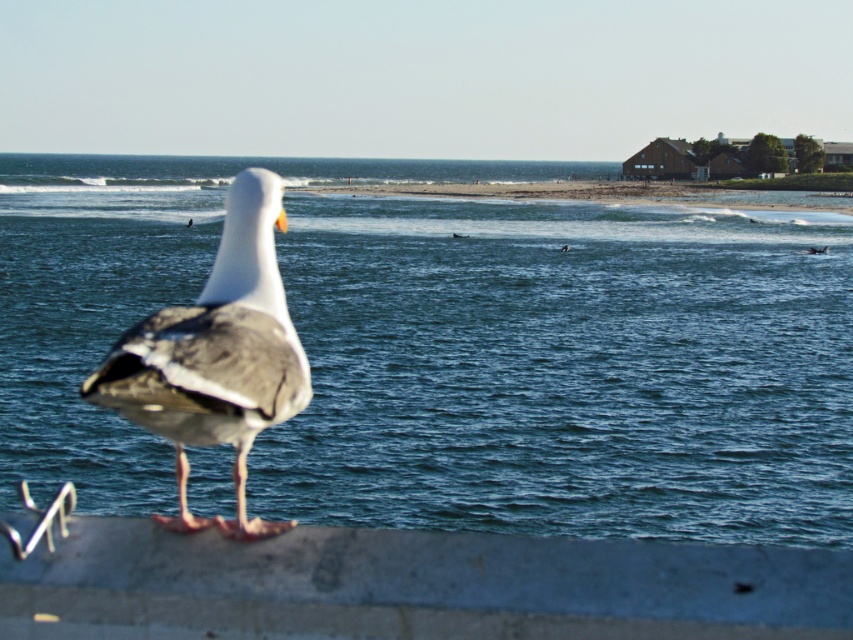
Question: Is gray concrete at lower center thinner than white matte seagull at center?

Choices:
 (A) yes
 (B) no

Answer: (A)

Question: Based on their relative distances, which object is nearer to the gray concrete at lower center?

Choices:
 (A) white matte seagull at center
 (B) blue water at center

Answer: (A)

Question: Based on their relative distances, which object is farther from the white matte seagull at center?

Choices:
 (A) gray concrete at lower center
 (B) blue water at center

Answer: (B)

Question: Is blue water at center smaller than white matte seagull at center?

Choices:
 (A) no
 (B) yes

Answer: (A)

Question: Is blue water at center below gray concrete at lower center?

Choices:
 (A) yes
 (B) no

Answer: (B)

Question: Among these points, which one is nearest to the camera?

Choices:
 (A) click(x=132, y=352)
 (B) click(x=718, y=465)

Answer: (A)